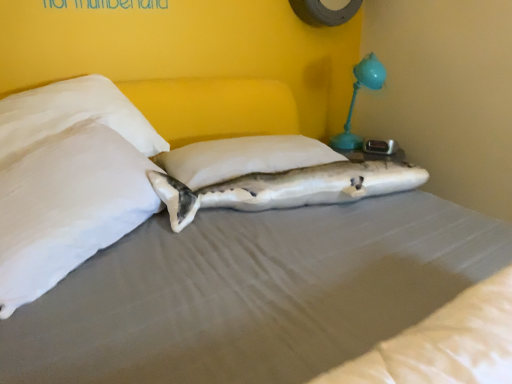
Question: Is white soft pillow at left, which appears as the first pillow when viewed from the left, behind teal plastic table lamp at upper right?

Choices:
 (A) no
 (B) yes

Answer: (A)

Question: Is white soft pillow at left, the 2th pillow from the right, to the right of teal plastic table lamp at upper right from the viewer's perspective?

Choices:
 (A) no
 (B) yes

Answer: (A)

Question: Could you tell me if white soft pillow at left, the 2th pillow from the right, is facing teal plastic table lamp at upper right?

Choices:
 (A) yes
 (B) no

Answer: (B)

Question: Is white soft pillow at left, which appears as the first pillow when viewed from the left, looking in the opposite direction of teal plastic table lamp at upper right?

Choices:
 (A) yes
 (B) no

Answer: (B)

Question: Is white soft pillow at left, the 2th pillow from the right, outside of teal plastic table lamp at upper right?

Choices:
 (A) no
 (B) yes

Answer: (B)

Question: From the image's perspective, relative to teal plastic table lamp at upper right, is white fabric shark at center above or below?

Choices:
 (A) above
 (B) below

Answer: (B)

Question: Relative to teal plastic table lamp at upper right, is white fabric shark at center in front or behind?

Choices:
 (A) front
 (B) behind

Answer: (A)

Question: Is white fabric shark at center to the left or to the right of teal plastic table lamp at upper right in the image?

Choices:
 (A) left
 (B) right

Answer: (A)

Question: Is white fabric shark at center inside the boundaries of teal plastic table lamp at upper right, or outside?

Choices:
 (A) outside
 (B) inside

Answer: (A)

Question: Is teal plastic table lamp at upper right in front of or behind white soft pillow at center, the 2th pillow viewed from the left, in the image?

Choices:
 (A) front
 (B) behind

Answer: (B)

Question: Is teal plastic table lamp at upper right bigger or smaller than white soft pillow at center, the 2th pillow viewed from the left?

Choices:
 (A) small
 (B) big

Answer: (B)

Question: From the image's perspective, is teal plastic table lamp at upper right located above or below white soft pillow at center, the 2th pillow viewed from the left?

Choices:
 (A) below
 (B) above

Answer: (B)

Question: Considering the positions of teal plastic table lamp at upper right and white soft pillow at center, the 2th pillow viewed from the left, in the image, is teal plastic table lamp at upper right wider or thinner than white soft pillow at center, the 2th pillow viewed from the left,?

Choices:
 (A) thin
 (B) wide

Answer: (A)

Question: From the image's perspective, relative to teal plastic table lamp at upper right, is white soft pillow at left, the 2th pillow from the right, above or below?

Choices:
 (A) above
 (B) below

Answer: (B)

Question: From a real-world perspective, is white soft pillow at left, the 2th pillow from the right, positioned above or below teal plastic table lamp at upper right?

Choices:
 (A) above
 (B) below

Answer: (B)